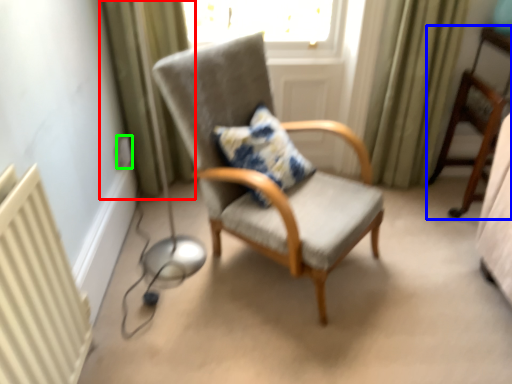
Question: Which is farther away from curtain (highlighted by a red box)? chair (highlighted by a blue box) or electric outlet (highlighted by a green box)?

Choices:
 (A) chair
 (B) electric outlet

Answer: (A)